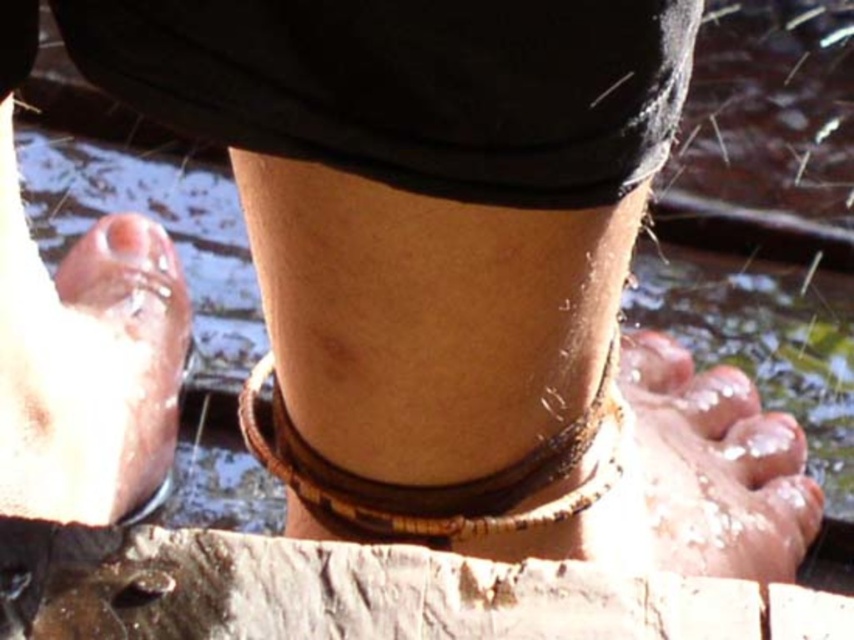
Question: Which of these objects is positioned farthest from the brown rough wood at lower center?

Choices:
 (A) glistening skin toe at lower center
 (B) brown leather anklet at center

Answer: (A)

Question: Is brown rough wood at lower center below pink smooth skin at lower left?

Choices:
 (A) yes
 (B) no

Answer: (A)

Question: Can you confirm if brown leather anklet at center is positioned above pink matte toe at lower right?

Choices:
 (A) no
 (B) yes

Answer: (B)

Question: In this image, where is pink smooth skin at lower left located relative to pink matte toe at lower right?

Choices:
 (A) below
 (B) above

Answer: (B)

Question: Which object is closer to the camera taking this photo?

Choices:
 (A) pink smooth skin at lower left
 (B) pink matte toe at lower right

Answer: (A)

Question: Among these objects, which one is nearest to the camera?

Choices:
 (A) pink smooth skin at lower left
 (B) brown leather anklet at center
 (C) glistening skin toe at lower center
 (D) pink matte toe at lower right

Answer: (B)